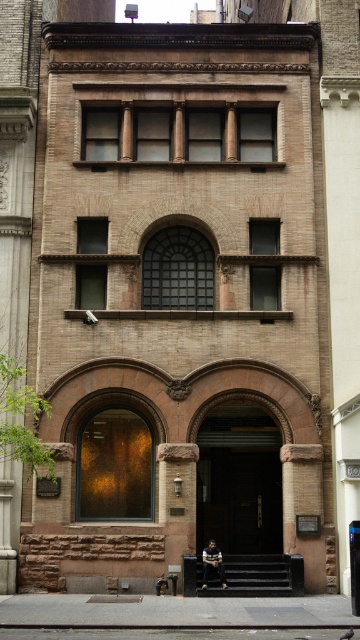
Who is positioned more to the left, wooden park bench at center or wooden park bench at lower center?

wooden park bench at lower center is more to the left.

Does wooden park bench at center have a smaller size compared to wooden park bench at lower center?

Actually, wooden park bench at center might be larger than wooden park bench at lower center.

The height and width of the screenshot is (640, 360). In order to click on wooden park bench at center in this screenshot , I will do `click(246, 576)`.

You are a GUI agent. You are given a task and a screenshot of the screen. Output one action in this format:
    pyautogui.click(x=<x>, y=<y>)
    Task: Click on the wooden park bench at center
    
    Given the screenshot: What is the action you would take?
    pyautogui.click(x=246, y=576)

Who is positioned more to the right, brown stone door at center or wooden park bench at center?

brown stone door at center

Is point (239, 524) farther from viewer compared to point (203, 595)?

That is True.

I want to click on brown stone door at center, so click(x=239, y=481).

Which is above, brown stone door at center or wooden park bench at lower center?

brown stone door at center

The image size is (360, 640). What do you see at coordinates (239, 481) in the screenshot?
I see `brown stone door at center` at bounding box center [239, 481].

Find the location of a particular element. Image resolution: width=360 pixels, height=640 pixels. brown stone door at center is located at coordinates (239, 481).

Identify the location of brown stone door at center. (239, 481).